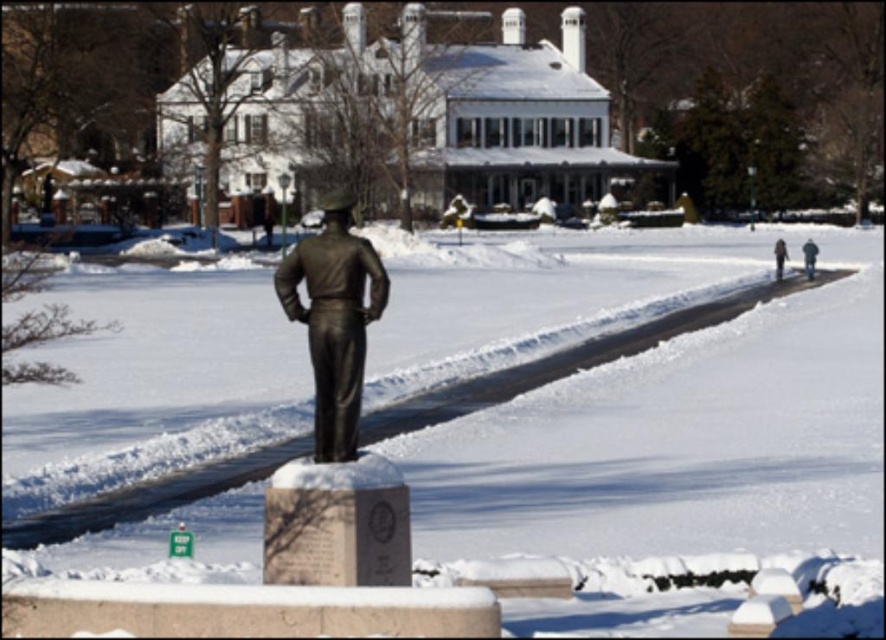
How distant is dark gray uniform at right from dark brown leather jacket at right?

A distance of 1.41 meters exists between dark gray uniform at right and dark brown leather jacket at right.

Where is `dark gray uniform at right`? The image size is (886, 640). dark gray uniform at right is located at coordinates (809, 257).

Does bronze statue at center have a greater height compared to dark gray uniform at right?

Correct, bronze statue at center is much taller as dark gray uniform at right.

Between bronze statue at center and dark gray uniform at right, which one has less height?

Standing shorter between the two is dark gray uniform at right.

Describe the element at coordinates (333, 320) in the screenshot. I see `bronze statue at center` at that location.

This screenshot has width=886, height=640. Find the location of `bronze statue at center`. bronze statue at center is located at coordinates (333, 320).

Which is more to the left, bronze statue at center or dark brown leather jacket at right?

bronze statue at center is more to the left.

Is the position of bronze statue at center less distant than that of dark brown leather jacket at right?

Yes, it is.

Does point (331, 195) come behind point (779, 252)?

That is False.

In order to click on bronze statue at center in this screenshot , I will do `click(333, 320)`.